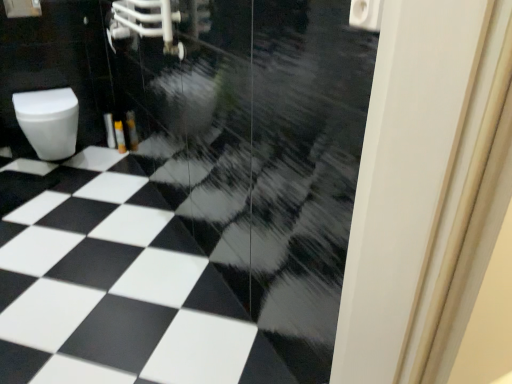
Question: Would you say black glossy tile at center is inside or outside white glossy toilet paper at upper right?

Choices:
 (A) outside
 (B) inside

Answer: (A)

Question: In the image, is black glossy tile at center positioned in front of or behind white glossy toilet paper at upper right?

Choices:
 (A) behind
 (B) front

Answer: (A)

Question: Estimate the real-world distances between objects in this image. Which object is closer to the white glossy toilet paper at upper right?

Choices:
 (A) white glossy door at right
 (B) black glossy tile at center
 (C) white glossy toilet at left

Answer: (A)

Question: Which object is positioned closest to the white glossy toilet paper at upper right?

Choices:
 (A) white glossy toilet at left
 (B) black glossy tile at center
 (C) white glossy door at right

Answer: (C)